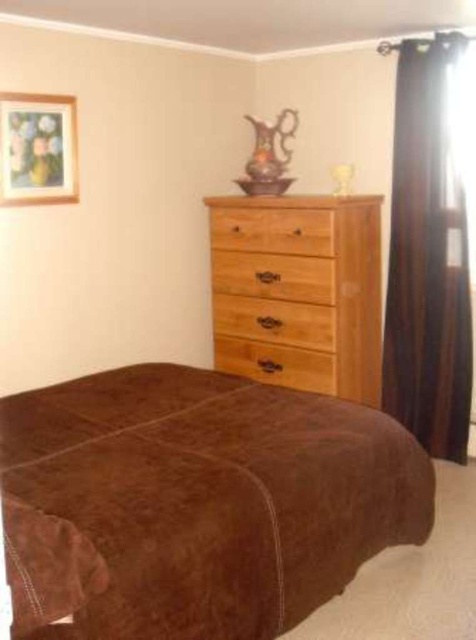
Does black velvet curtain at right have a greater width compared to brown wood drawer at center?

In fact, black velvet curtain at right might be narrower than brown wood drawer at center.

Which is in front, point (429, 371) or point (307, 298)?

Positioned in front is point (307, 298).

Between point (396, 184) and point (278, 256), which one is positioned in front?

Point (396, 184)

Where is `black velvet curtain at right`? The image size is (476, 640). black velvet curtain at right is located at coordinates (427, 257).

Which is more to the left, natural wood drawer at center or wooden drawer at center?

natural wood drawer at center

Does natural wood drawer at center appear under wooden drawer at center?

No.

Where is `natural wood drawer at center`? The height and width of the screenshot is (640, 476). natural wood drawer at center is located at coordinates (273, 228).

Does brown suede bed at center have a smaller size compared to brown wood drawer at center?

Incorrect, brown suede bed at center is not smaller in size than brown wood drawer at center.

Which is behind, point (13, 618) or point (300, 285)?

The point (300, 285) is behind.

Between point (327, 573) and point (269, 262), which one is positioned behind?

Point (269, 262)

The image size is (476, 640). Identify the location of brown suede bed at center. (196, 502).